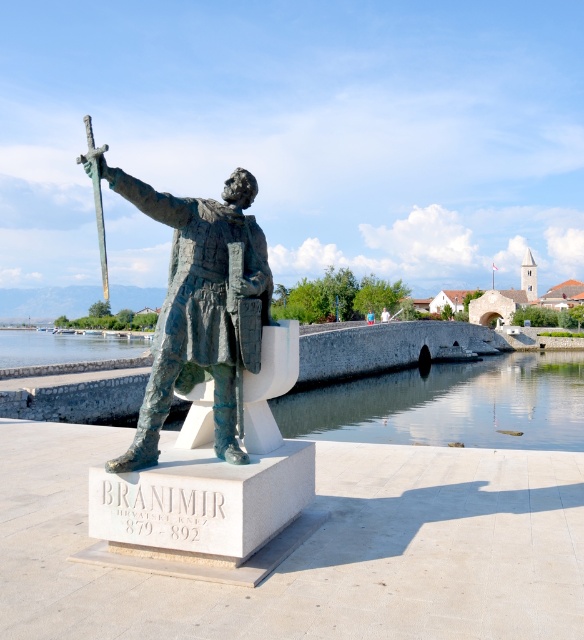
Can you confirm if clear water at statue right is shorter than bronze statue at center?

No, clear water at statue right is not shorter than bronze statue at center.

Is clear water at statue right in front of bronze statue at center?

No.

Describe the element at coordinates (432, 388) in the screenshot. I see `clear water at statue right` at that location.

At what (x,y) coordinates should I click in order to perform the action: click on clear water at statue right. Please return your answer as a coordinate pair (x, y). The image size is (584, 640). Looking at the image, I should click on pyautogui.click(x=432, y=388).

Who is higher up, clear water at statue right or bronze metallic sword at center?

bronze metallic sword at center is above.

Between point (440, 321) and point (105, 264), which one is positioned in front?

Positioned in front is point (440, 321).

Between point (88, 412) and point (88, 134), which one is positioned in front?

Point (88, 134) is more forward.

Where is `clear water at statue right`? clear water at statue right is located at coordinates (432, 388).

Can you confirm if bronze statue at center is bigger than bronze metallic sword at center?

Actually, bronze statue at center might be smaller than bronze metallic sword at center.

How much distance is there between bronze statue at center and bronze metallic sword at center?

They are 5.53 meters apart.

Is point (223, 250) less distant than point (78, 157)?

No, (223, 250) is further to viewer.

I want to click on bronze statue at center, so click(x=196, y=305).